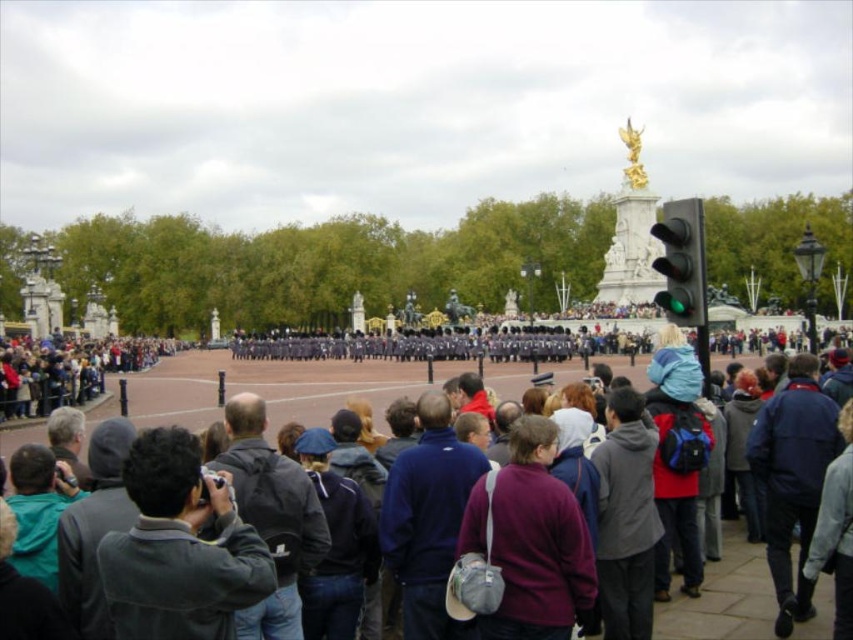
Consider the image. Is dark gray jacket at left positioned in front of green glass traffic light at center?

That is False.

From the picture: Is dark gray jacket at left thinner than green glass traffic light at center?

No, dark gray jacket at left is not thinner than green glass traffic light at center.

What do you see at coordinates (68, 371) in the screenshot?
I see `dark gray jacket at left` at bounding box center [68, 371].

This screenshot has height=640, width=853. What are the coordinates of `dark gray jacket at left` in the screenshot? It's located at (68, 371).

Between dark gray jacket at center and green glass traffic light at center, which one has more height?

Standing taller between the two is dark gray jacket at center.

Who is more forward, (318, 376) or (699, 262)?

Point (699, 262) is in front.

This screenshot has height=640, width=853. Find the location of `dark gray jacket at center`. dark gray jacket at center is located at coordinates (271, 387).

Is dark gray jacket at center thinner than dark gray jacket at left?

No, dark gray jacket at center is not thinner than dark gray jacket at left.

Does dark gray jacket at center lie behind dark gray jacket at left?

That is False.

Is point (180, 376) positioned in front of point (88, 358)?

No.

I want to click on dark gray jacket at center, so click(271, 387).